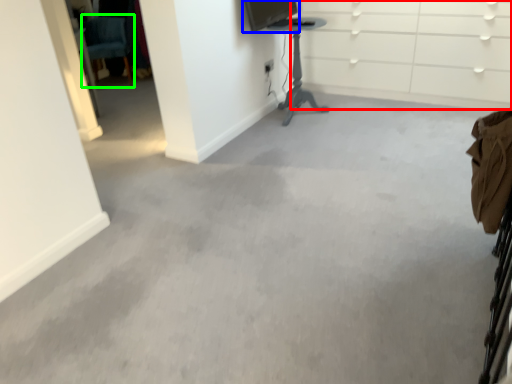
Question: Which object is positioned closest to dresser (highlighted by a red box)? Select from computer monitor (highlighted by a blue box) and swivel chair (highlighted by a green box).

Choices:
 (A) computer monitor
 (B) swivel chair

Answer: (A)